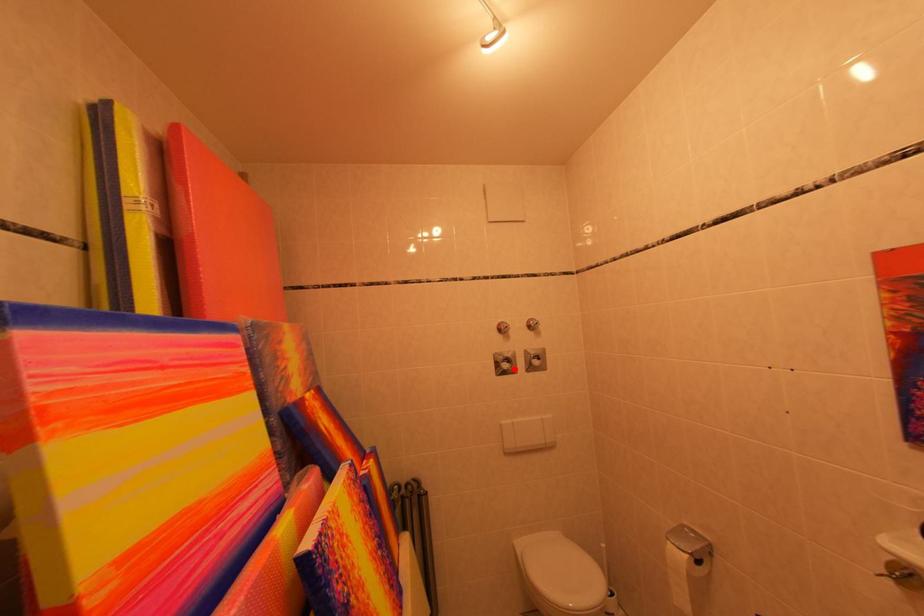
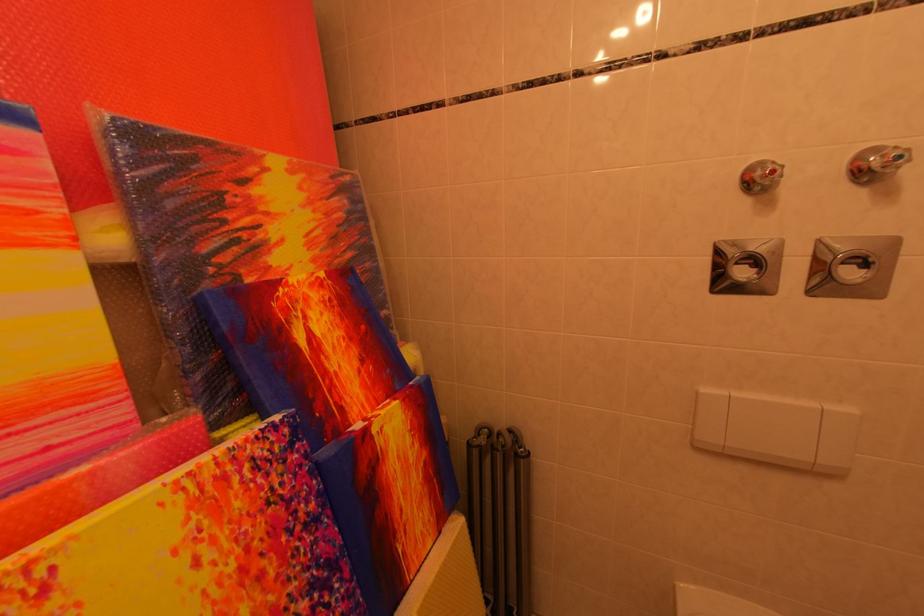
Where in the second image is the point corresponding to the highlighted location from the first image?

(751, 277)